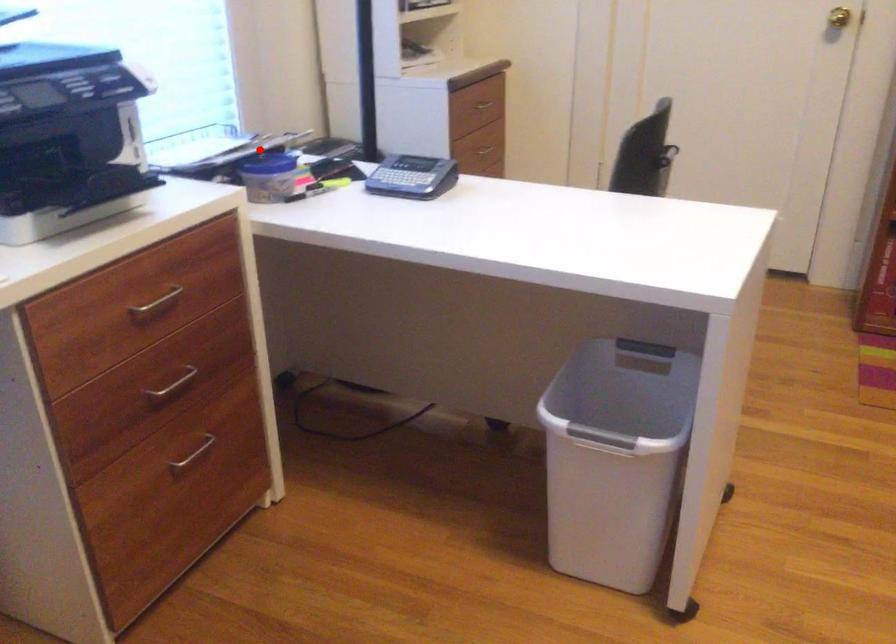
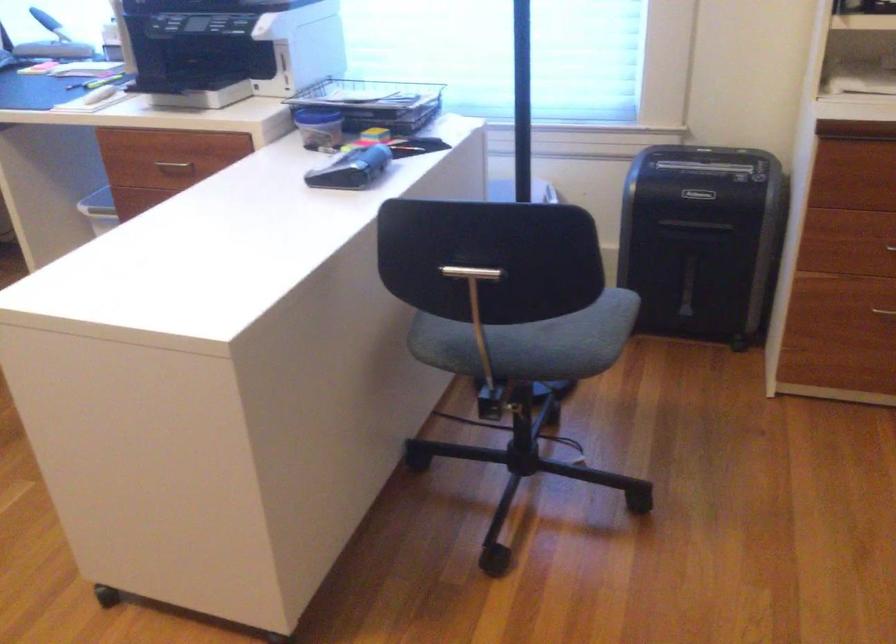
Locate, in the second image, the point that corresponds to the highlighted location in the first image.

(374, 102)